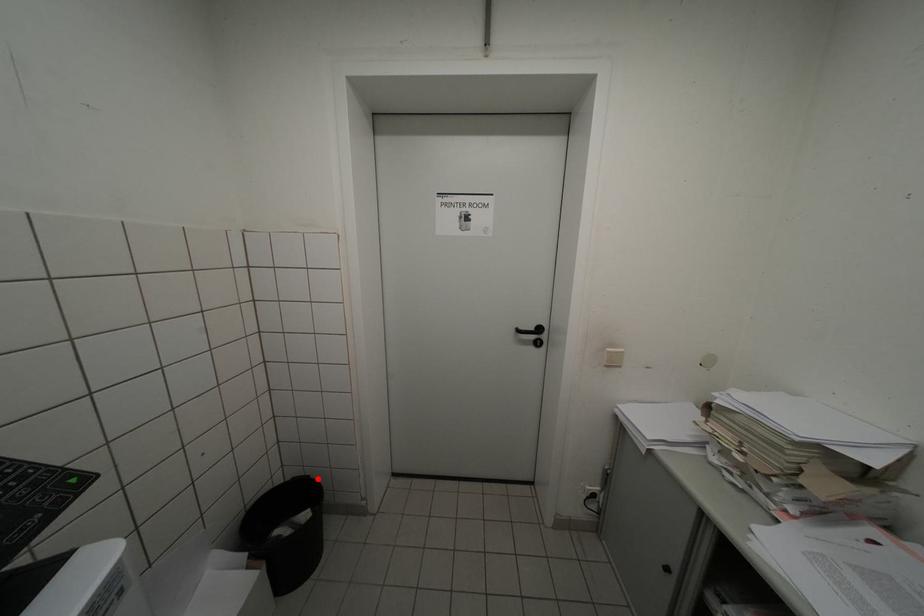
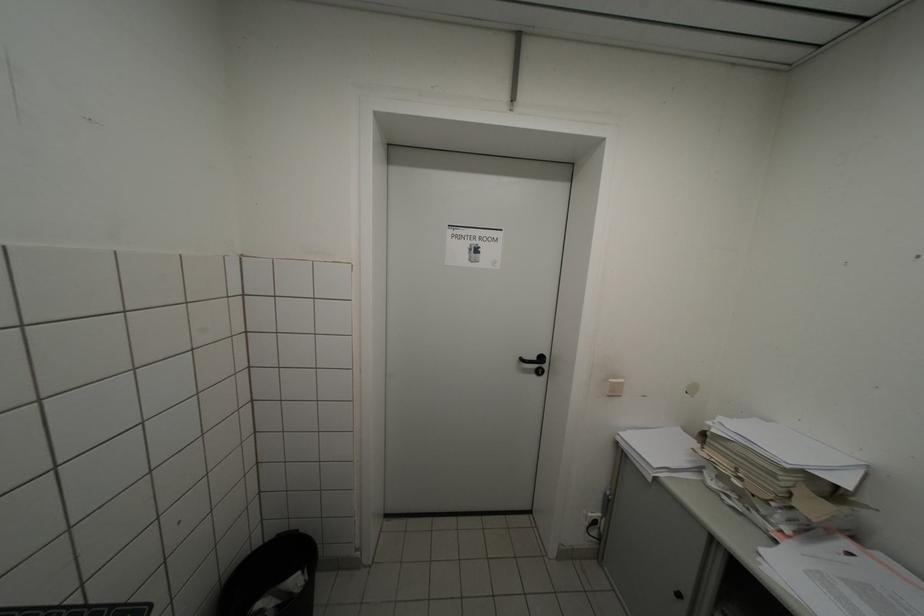
Question: I am providing you with two images of the same scene from different viewpoints. Given a red point in image1, look at the same physical point in image2. Is it:

Choices:
 (A) Closer to the viewpoint
 (B) Farther from the viewpoint

Answer: (A)